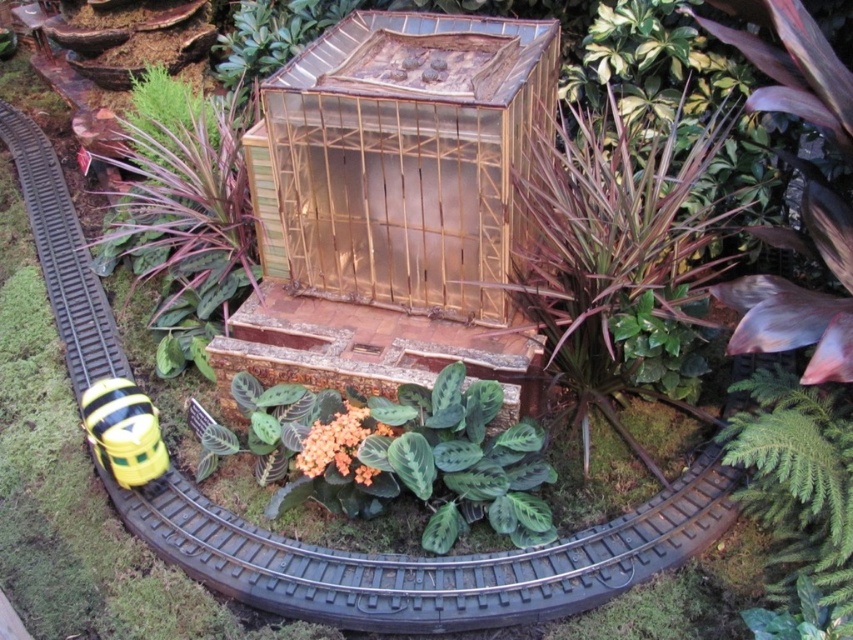
Between point (788, 518) and point (96, 458), which one is positioned in front?

Positioned in front is point (788, 518).

Consider the image. Between green leafy fern at lower right and yellow matte toy at lower left, which one appears on the right side from the viewer's perspective?

green leafy fern at lower right

Identify the location of green leafy fern at lower right. (798, 481).

Is point (512, 202) less distant than point (782, 531)?

No, (512, 202) is further to viewer.

I want to click on transparent bamboo cage at center, so click(x=407, y=157).

Identify the location of transparent bamboo cage at center. (407, 157).

Which is above, transparent bamboo cage at center or yellow matte toy at lower left?

Positioned higher is transparent bamboo cage at center.

Is point (465, 236) positioned behind point (91, 413)?

Yes.

Find the location of a particular element. This screenshot has width=853, height=640. transparent bamboo cage at center is located at coordinates (407, 157).